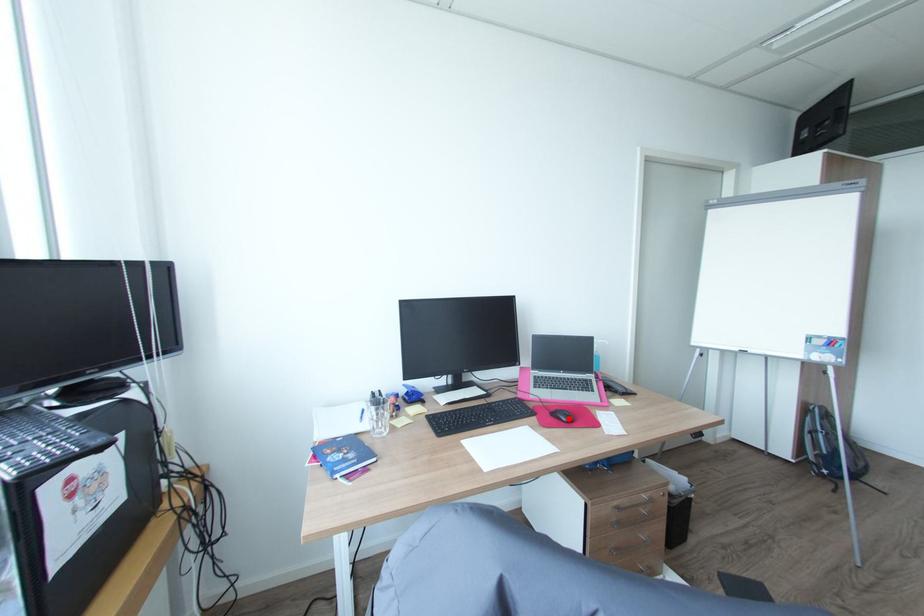
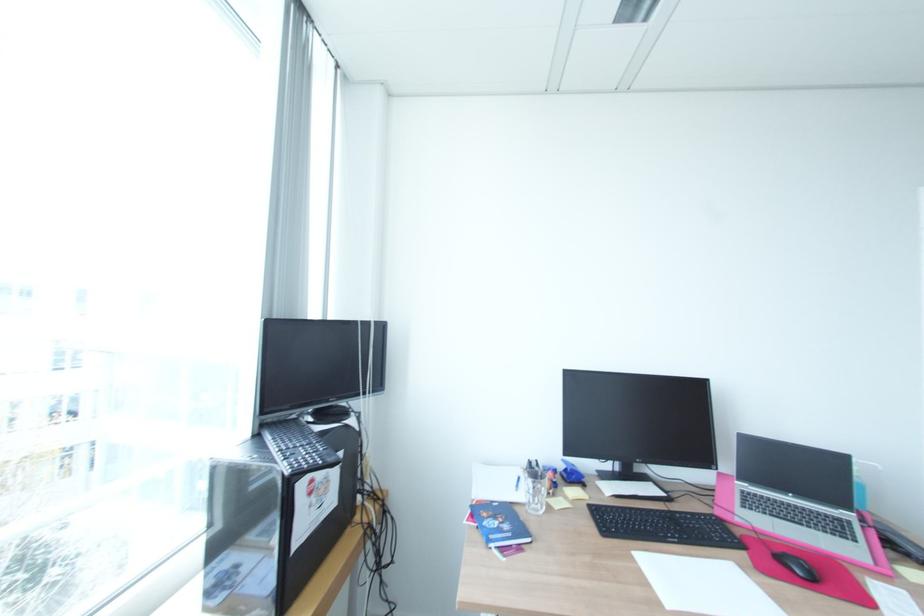
Question: A red point is marked in image1. In image2, is the corresponding 3D point closer to the camera or farther? Reply with the corresponding letter.

Choices:
 (A) The corresponding 3D point is closer.
 (B) The corresponding 3D point is farther.

Answer: (A)